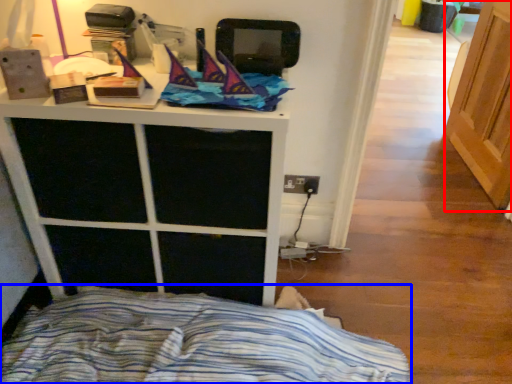
Question: Which object appears closest to the camera in this image, screen door (highlighted by a red box) or bed (highlighted by a blue box)?

Choices:
 (A) screen door
 (B) bed

Answer: (B)